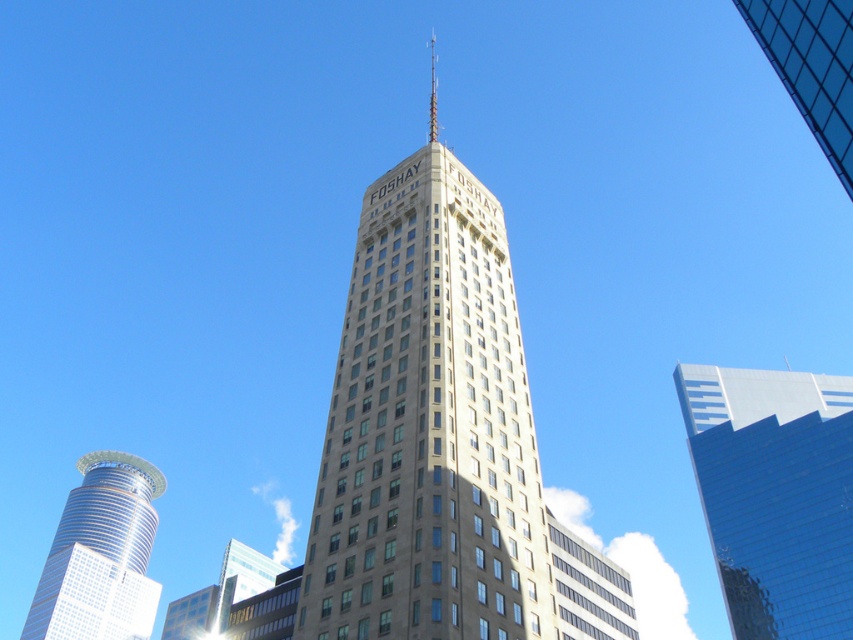
You are standing in front of the FOSHAY skyscraper and want to take a photo. You notice two points on the building labeled as point 1 and point 2. Point 1 is at coordinates point (x=403, y=384) and point 2 is at point (x=798, y=99). Which point is closer to you when you are facing the building?

Point 1 at coordinates point (x=403, y=384) is closer to you because it is further to the viewer than point 2 at point (x=798, y=99).

Based on the photo, you are a city planner assessing the skyline. You need to determine if the beige glass tower at center will block sunlight to the transparent glass building at upper right. Based on their positions and sizes, what should you consider?

The beige glass tower at center might be wider than transparent glass building at upper right, so its width could potentially block more sunlight if positioned directly in front or to the side of the transparent glass building at upper right.